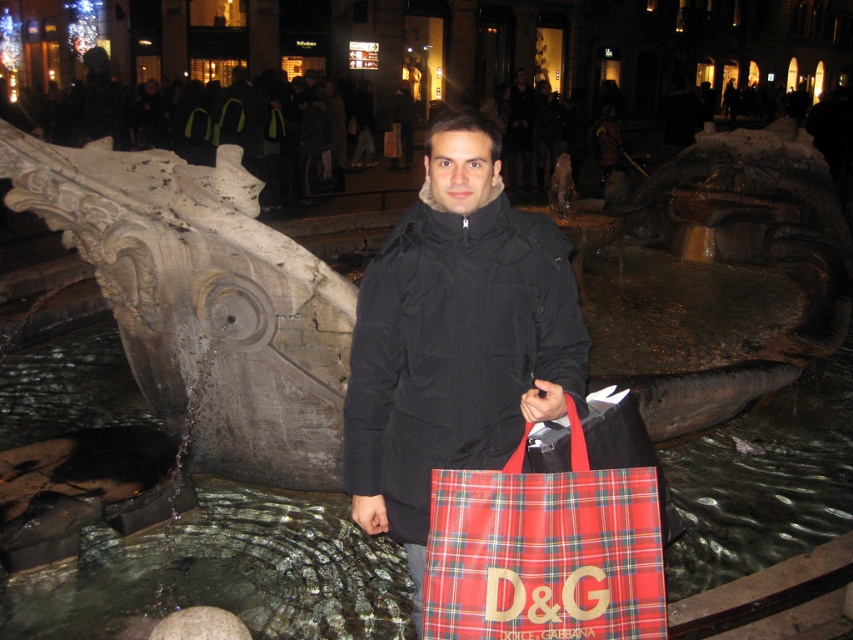
Who is positioned more to the left, black matte coat at center or red plaid fabric shopping bag at center?

black matte coat at center

Is black matte coat at center shorter than red plaid fabric shopping bag at center?

In fact, black matte coat at center may be taller than red plaid fabric shopping bag at center.

At what (x,y) coordinates should I click in order to perform the action: click on black matte coat at center. Please return your answer as a coordinate pair (x, y). Looking at the image, I should click on (456, 337).